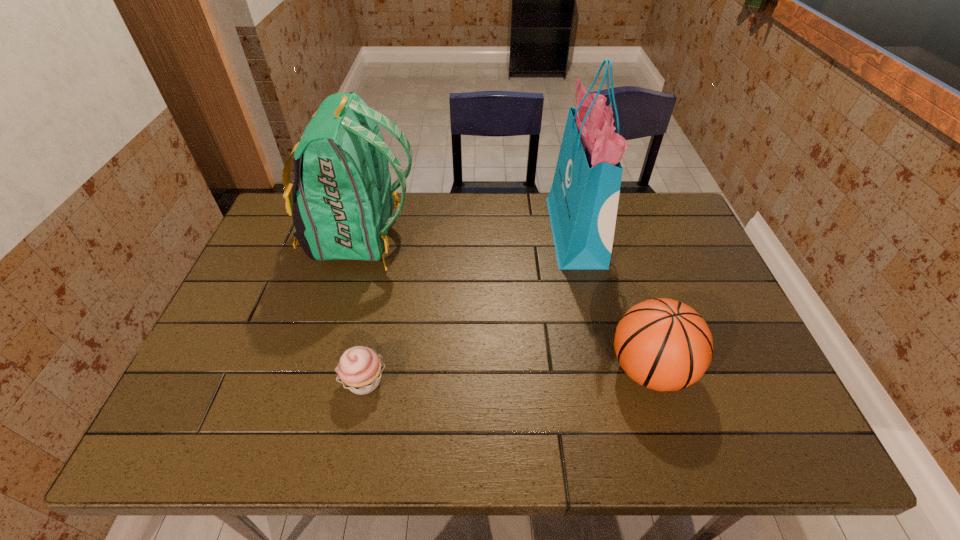
The image size is (960, 540). In order to click on object situated at the left edge in this screenshot , I will do `click(341, 201)`.

Where is `object that is positioned at the far left corner`? This screenshot has height=540, width=960. object that is positioned at the far left corner is located at coordinates (341, 201).

Identify the location of vacant space at the far edge. (427, 206).

This screenshot has height=540, width=960. Find the location of `vacant space at the near edge of the desktop`. vacant space at the near edge of the desktop is located at coordinates (339, 445).

Where is `free space at the left edge of the desktop`? The width and height of the screenshot is (960, 540). free space at the left edge of the desktop is located at coordinates tap(275, 335).

The image size is (960, 540). In order to click on vacant space at the right edge of the desktop in this screenshot , I will do `click(674, 268)`.

Identify the location of vacant space at the near right corner. (780, 422).

Where is `free spot between the third shortest object and the cupcake`? The height and width of the screenshot is (540, 960). free spot between the third shortest object and the cupcake is located at coordinates (362, 309).

The height and width of the screenshot is (540, 960). I want to click on empty space that is in between the third shortest object and the third tallest object, so click(505, 303).

Locate an element on the screen. The width and height of the screenshot is (960, 540). empty location between the second tallest object and the shopping bag is located at coordinates (468, 235).